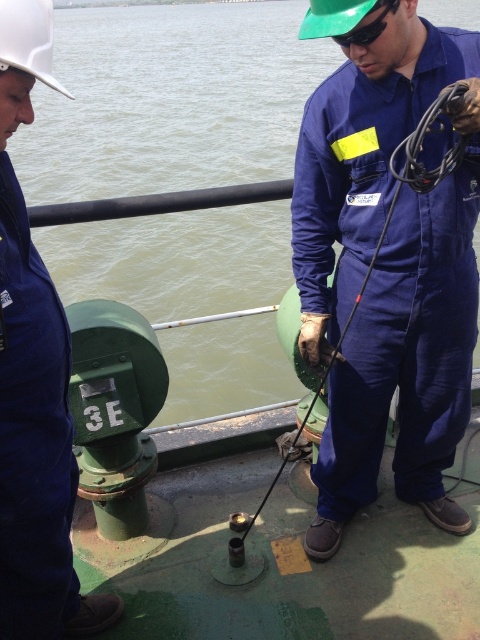
Question: Can you confirm if blue fabric jumpsuit at center is smaller than blue matte jumpsuit at left?

Choices:
 (A) no
 (B) yes

Answer: (A)

Question: Which point is farther from the camera taking this photo?

Choices:
 (A) (11, 413)
 (B) (409, 314)

Answer: (B)

Question: Does white hard hat at upper left appear under green matte safety goggles at upper center?

Choices:
 (A) yes
 (B) no

Answer: (A)

Question: Which of these objects is positioned farthest from the blue matte jumpsuit at left?

Choices:
 (A) white hard hat at upper left
 (B) blue fabric jumpsuit at center

Answer: (B)

Question: Which object is closer to the camera taking this photo?

Choices:
 (A) green matte safety goggles at upper center
 (B) blue fabric jumpsuit at center
 (C) blue matte jumpsuit at left
 (D) green rubber water at center

Answer: (C)

Question: Can you confirm if blue fabric jumpsuit at center is wider than green matte safety goggles at upper center?

Choices:
 (A) yes
 (B) no

Answer: (A)